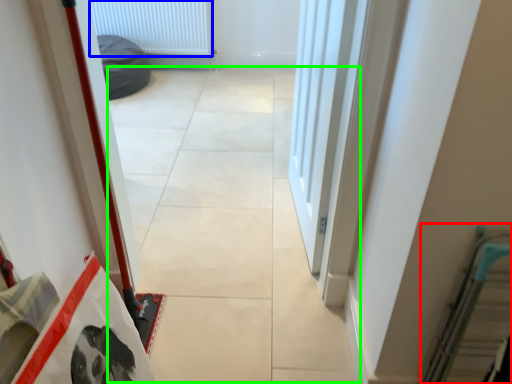
Question: Estimate the real-world distances between objects in this image. Which object is farther from escalator (highlighted by a red box), radiator (highlighted by a blue box) or concrete (highlighted by a green box)?

Choices:
 (A) radiator
 (B) concrete

Answer: (A)